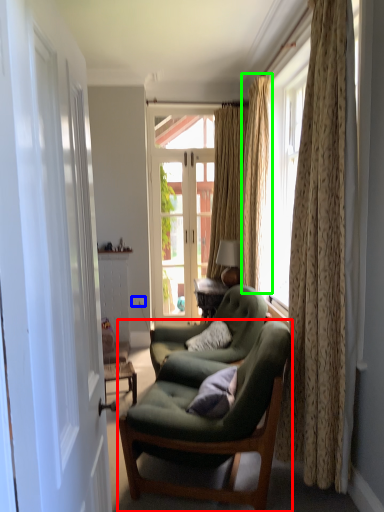
Question: Based on their relative distances, which object is farther from chair (highlighted by a red box)? Choose from power outlet (highlighted by a blue box) and curtain (highlighted by a green box).

Choices:
 (A) power outlet
 (B) curtain

Answer: (A)